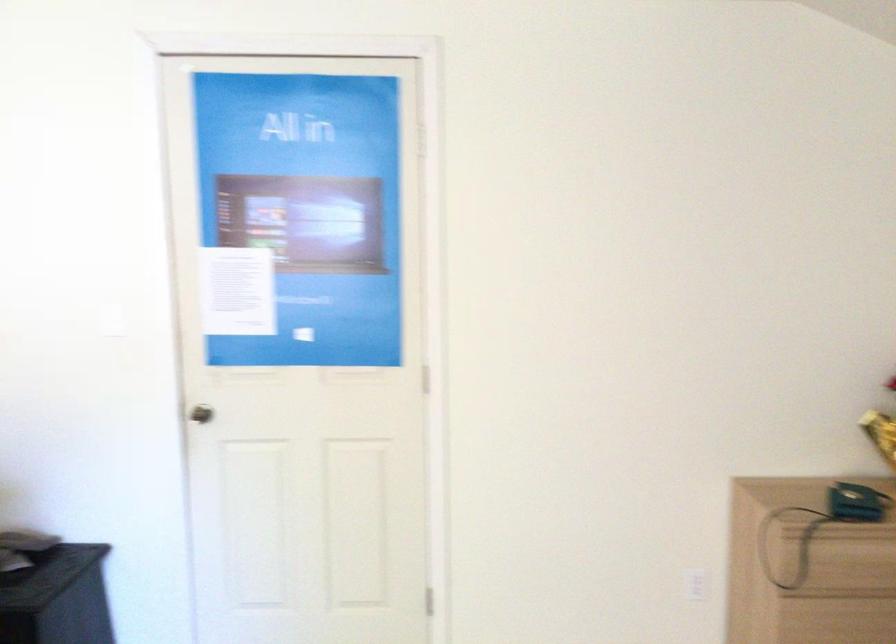
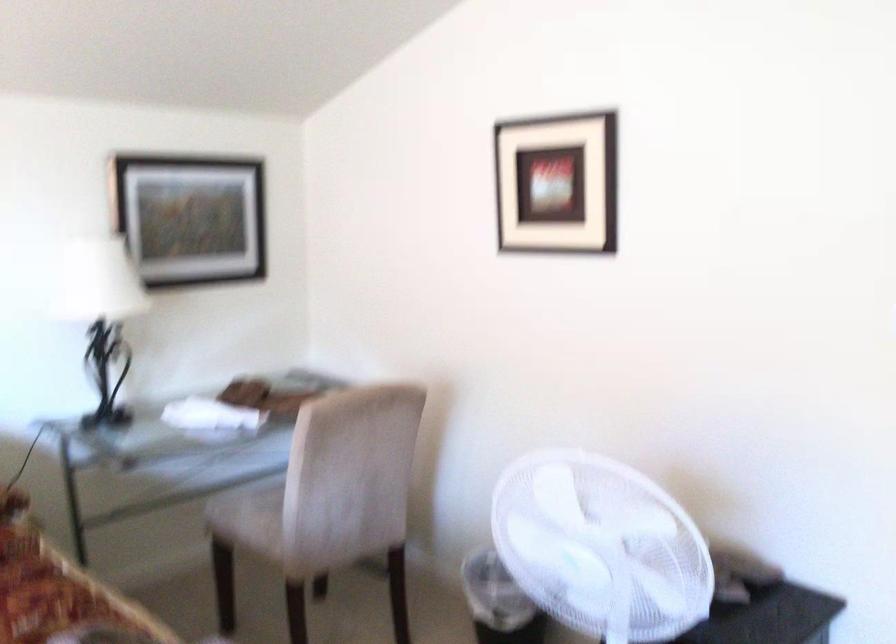
Question: The camera is either moving clockwise (left) or counter-clockwise (right) around the object. The first image is from the beginning of the video and the second image is from the end. Is the camera moving left or right when shooting the video?

Choices:
 (A) Left
 (B) Right

Answer: (B)